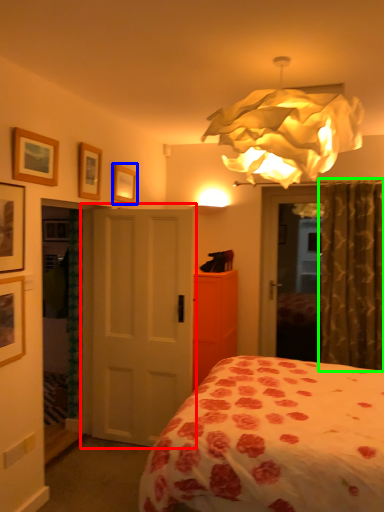
Question: Which is farther away from door (highlighted by a red box)? picture frame (highlighted by a blue box) or curtain (highlighted by a green box)?

Choices:
 (A) picture frame
 (B) curtain

Answer: (B)